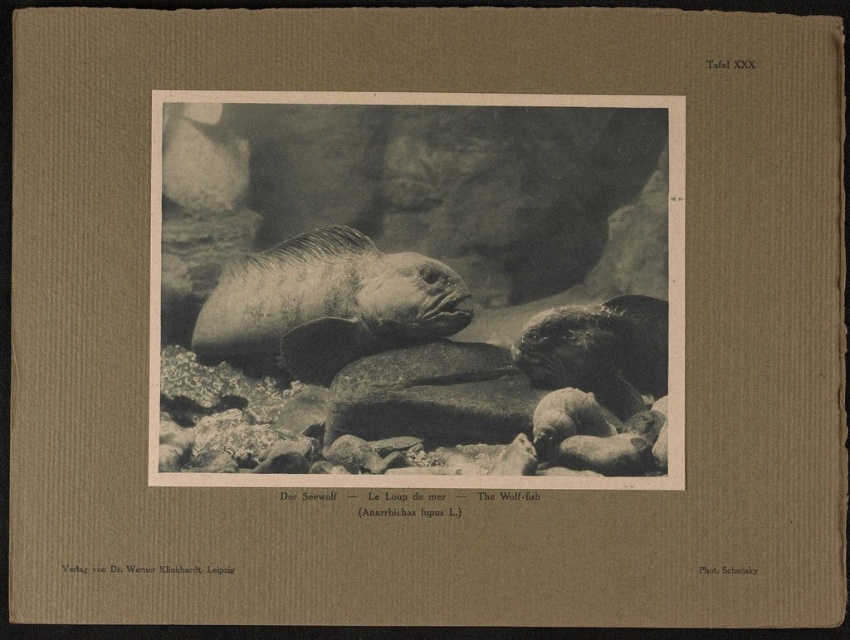
Question: Among these objects, which one is nearest to the camera?

Choices:
 (A) shiny dark gray wolf fish at center
 (B) gray textured fish at center

Answer: (B)

Question: Is gray textured fish at center to the left of shiny dark gray wolf fish at center from the viewer's perspective?

Choices:
 (A) no
 (B) yes

Answer: (B)

Question: Can you confirm if gray textured fish at center is smaller than shiny dark gray wolf fish at center?

Choices:
 (A) no
 (B) yes

Answer: (A)

Question: Which object appears farthest from the camera in this image?

Choices:
 (A) shiny dark gray wolf fish at center
 (B) gray textured fish at center

Answer: (A)

Question: Does gray textured fish at center appear on the right side of shiny dark gray wolf fish at center?

Choices:
 (A) no
 (B) yes

Answer: (A)